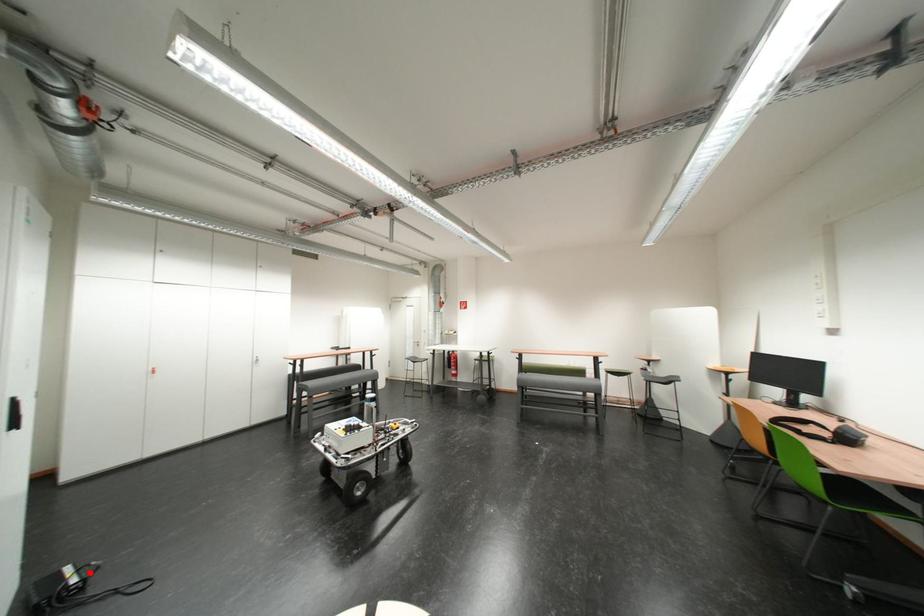
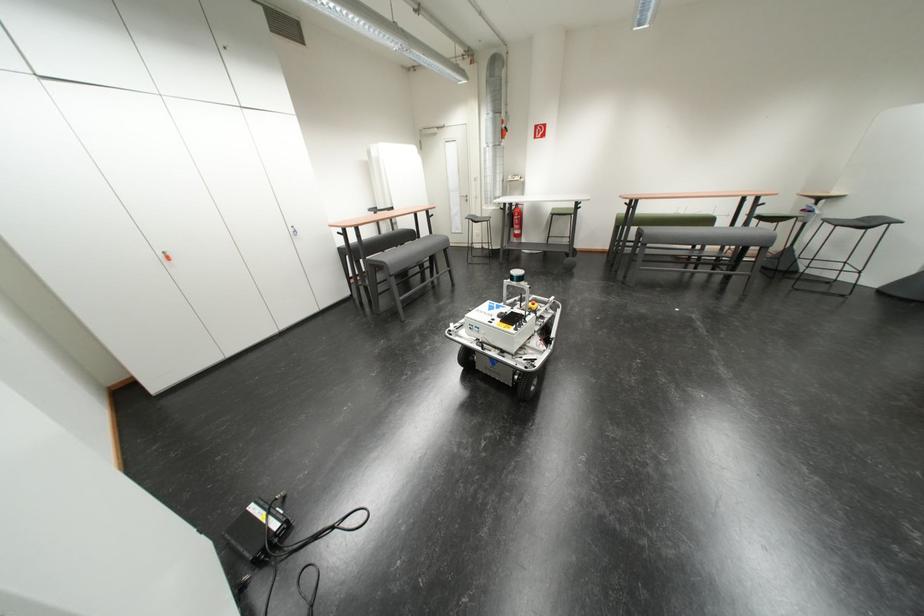
Locate, in the second image, the point that corresponds to the highlighted location in the first image.

(281, 516)